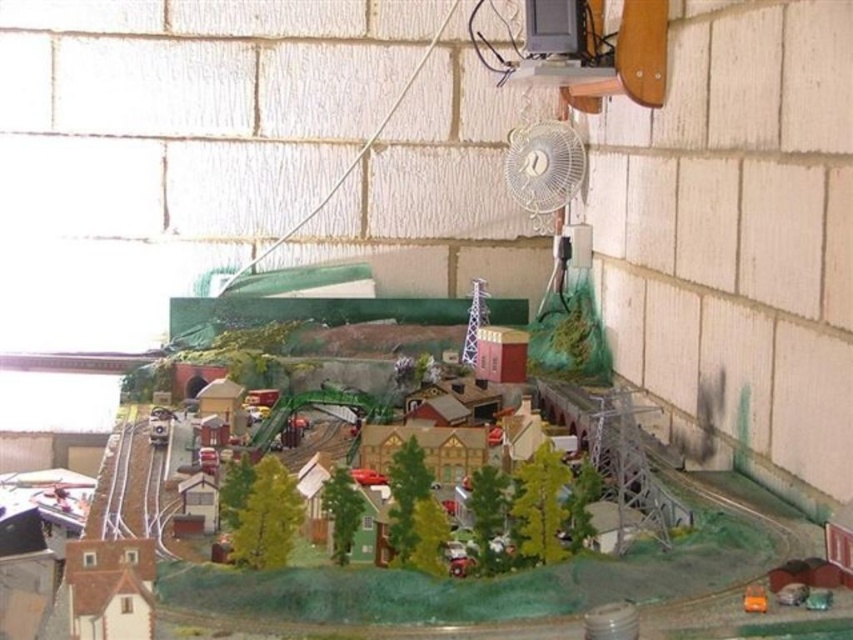
Question: Considering the real-world distances, which object is farthest from the white plastic train track at lower left?

Choices:
 (A) white plastic fan at upper center
 (B) orange matte toy at lower right

Answer: (A)

Question: Which of the following is the closest to the observer?

Choices:
 (A) (154, 472)
 (B) (762, 602)

Answer: (B)

Question: Which object is farther from the camera taking this photo?

Choices:
 (A) white plastic train track at lower left
 (B) white plastic fan at upper center
 (C) orange matte toy at lower right

Answer: (B)

Question: Is white plastic train track at lower left positioned in front of orange matte toy at lower right?

Choices:
 (A) no
 (B) yes

Answer: (A)

Question: Can you confirm if white plastic train track at lower left is positioned to the right of orange matte toy at lower right?

Choices:
 (A) no
 (B) yes

Answer: (A)

Question: Can you confirm if white plastic fan at upper center is bigger than white plastic train track at lower left?

Choices:
 (A) no
 (B) yes

Answer: (A)